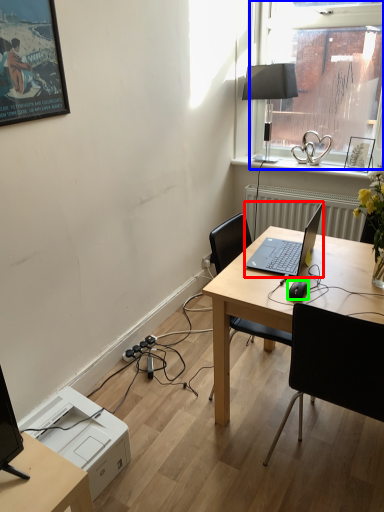
Question: Which object is the closest to the laptop (highlighted by a red box)? Choose among these: window (highlighted by a blue box) or computer mouse (highlighted by a green box).

Choices:
 (A) window
 (B) computer mouse

Answer: (B)